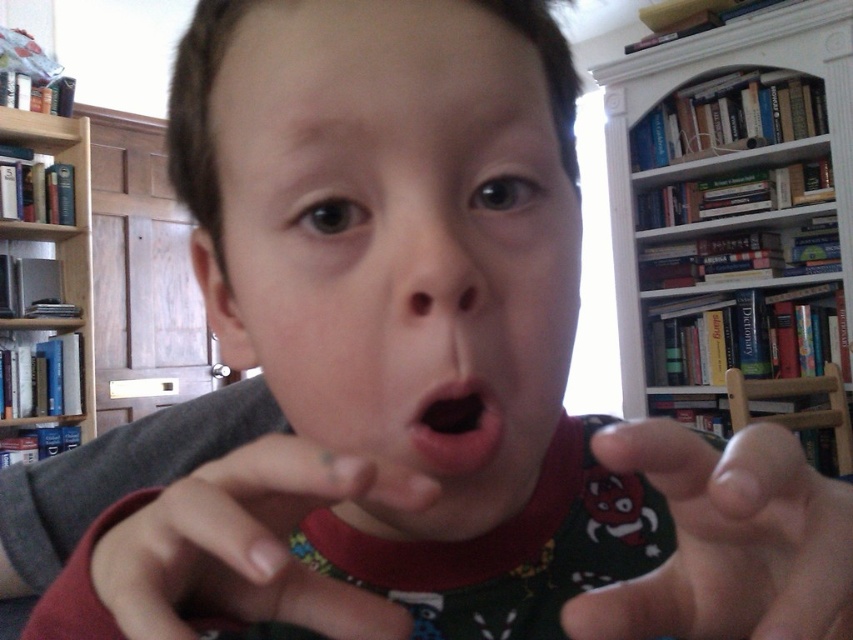
Question: Is white wooden bookcase at upper right smaller than black matte mouth at center?

Choices:
 (A) no
 (B) yes

Answer: (A)

Question: Which point is farther to the camera?

Choices:
 (A) (312, 81)
 (B) (61, 312)
 (C) (384, 625)

Answer: (B)

Question: Which object is farther from the camera taking this photo?

Choices:
 (A) black matte mouth at center
 (B) smooth skin hand at center
 (C) dark gray fabric hand at center

Answer: (A)

Question: Is white wooden bookcase at upper right further to camera compared to black matte mouth at center?

Choices:
 (A) yes
 (B) no

Answer: (A)

Question: Considering the relative positions of white wooden bookcase at upper right and black matte mouth at center in the image provided, where is white wooden bookcase at upper right located with respect to black matte mouth at center?

Choices:
 (A) left
 (B) right

Answer: (B)

Question: Which is nearer to the smooth skin face at center?

Choices:
 (A) white wooden bookcase at upper right
 (B) smooth skin hand at center
 (C) blue hardcover books at left

Answer: (B)